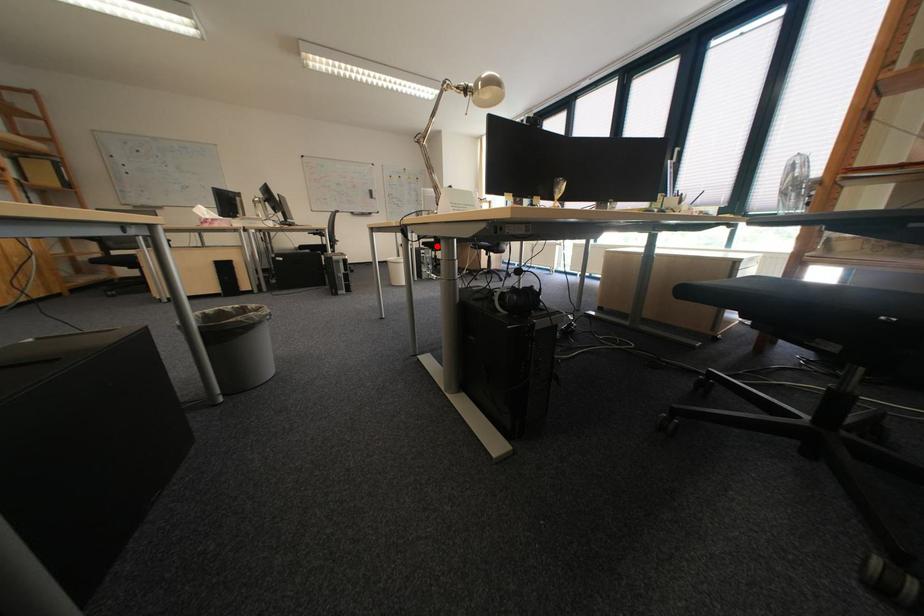
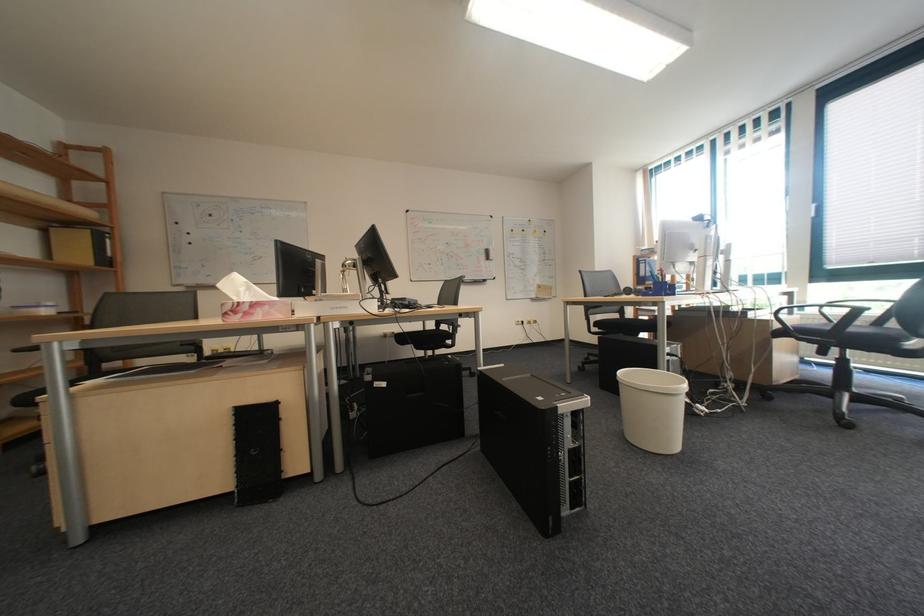
Locate, in the second image, the point that corresponds to the highlighted location in the first image.

(609, 328)